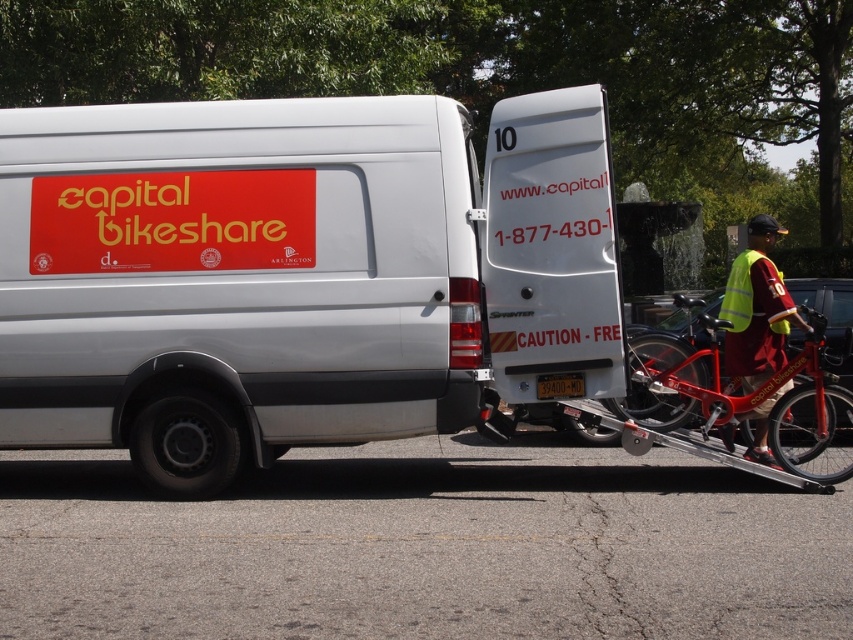
Question: Does metallic red bicycle at right appear over reflective yellow vest at right?

Choices:
 (A) no
 (B) yes

Answer: (A)

Question: Which point is farther to the camera?

Choices:
 (A) (657, 355)
 (B) (738, 419)

Answer: (A)

Question: Which of the following is the farthest from the observer?

Choices:
 (A) (735, 349)
 (B) (796, 388)

Answer: (A)

Question: Does white matte van at center have a smaller size compared to metallic red bicycle at right?

Choices:
 (A) no
 (B) yes

Answer: (B)

Question: Considering the relative positions of white matte van at center and reflective yellow vest at right in the image provided, where is white matte van at center located with respect to reflective yellow vest at right?

Choices:
 (A) left
 (B) right

Answer: (A)

Question: Which of the following is the closest to the observer?

Choices:
 (A) white matte van at center
 (B) metallic red bicycle at right
 (C) reflective yellow vest at right

Answer: (A)